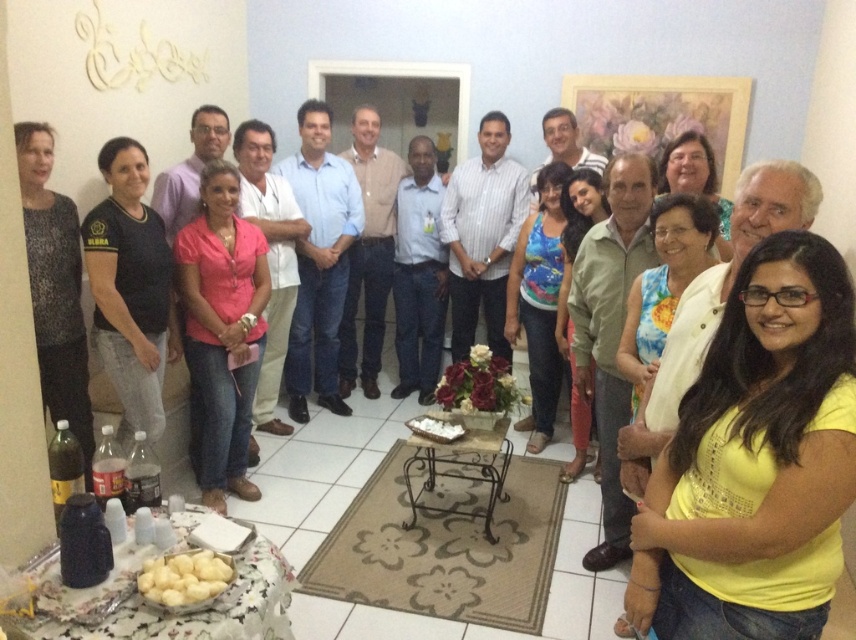
Question: Can you confirm if pink fabric shirt at center is wider than multicolored printed tank top at center?

Choices:
 (A) yes
 (B) no

Answer: (A)

Question: Which object is positioned farthest from the black matte shirt at left?

Choices:
 (A) multicolored floral dress at center
 (B) yellow matte shirt at center
 (C) multicolored printed tank top at center
 (D) sparkly silver dress at left

Answer: (B)

Question: Which object is the closest to the pink fabric shirt at center?

Choices:
 (A) matte black shirt at center
 (B) multicolored floral dress at center
 (C) multicolored printed tank top at center
 (D) sparkly silver dress at left

Answer: (D)

Question: Which of these objects is positioned farthest from the multicolored floral dress at center?

Choices:
 (A) matte black shirt at center
 (B) black matte shirt at left
 (C) multicolored printed tank top at center

Answer: (B)

Question: Can you confirm if multicolored printed tank top at center is positioned to the right of matte black shirt at center?

Choices:
 (A) no
 (B) yes

Answer: (A)

Question: Does multicolored printed tank top at center lie in front of matte black shirt at center?

Choices:
 (A) yes
 (B) no

Answer: (B)